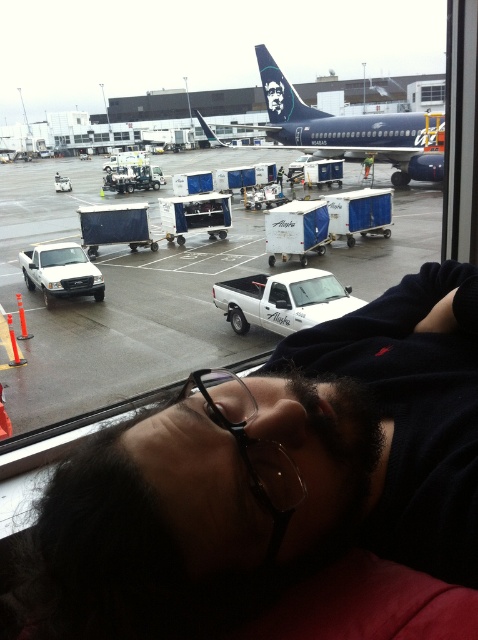
Is dark hair at lower center to the right of blue metallic airplane at center from the viewer's perspective?

Indeed, dark hair at lower center is positioned on the right side of blue metallic airplane at center.

What are the coordinates of `dark hair at lower center` in the screenshot? It's located at (271, 476).

This screenshot has height=640, width=478. Identify the location of dark hair at lower center. (271, 476).

At what (x,y) coordinates should I click in order to perform the action: click on dark hair at lower center. Please return your answer as a coordinate pair (x, y). The width and height of the screenshot is (478, 640). Looking at the image, I should click on (271, 476).

The image size is (478, 640). What do you see at coordinates (271, 476) in the screenshot?
I see `dark hair at lower center` at bounding box center [271, 476].

Which of these two, dark hair at lower center or transparent glass window at upper center, stands shorter?

dark hair at lower center

Between point (456, 346) and point (424, 100), which one is positioned in front?

Positioned in front is point (456, 346).

The width and height of the screenshot is (478, 640). Find the location of `dark hair at lower center`. dark hair at lower center is located at coordinates (271, 476).

Where is `dark hair at lower center`? dark hair at lower center is located at coordinates pyautogui.click(x=271, y=476).

Is the position of dark hair at lower center more distant than that of white plastic containers at center?

No, dark hair at lower center is closer to the viewer.

The image size is (478, 640). What do you see at coordinates (271, 476) in the screenshot?
I see `dark hair at lower center` at bounding box center [271, 476].

Find the location of `dark hair at lower center`. dark hair at lower center is located at coordinates (271, 476).